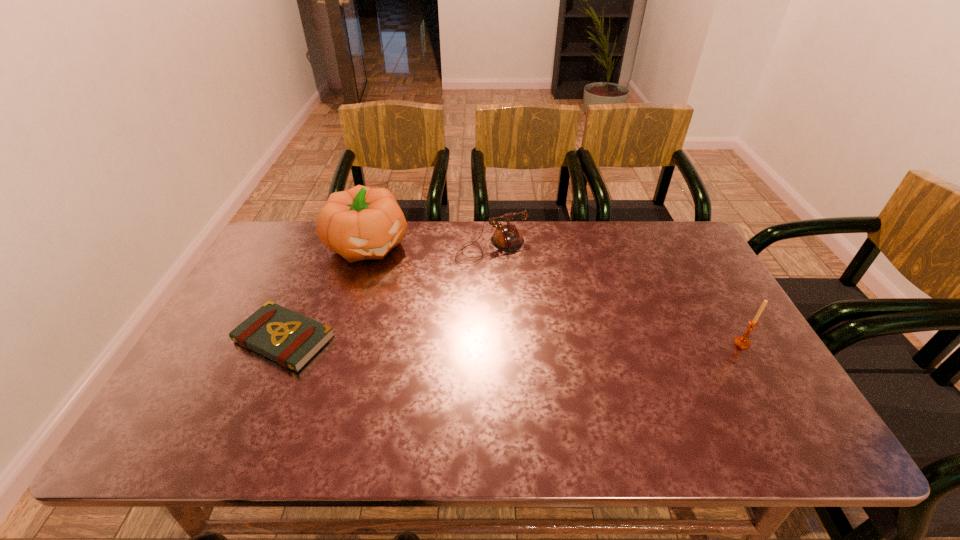
Find the location of a particular element. This screenshot has width=960, height=540. book is located at coordinates (291, 339).

Find the location of a particular element. The width and height of the screenshot is (960, 540). candle_holder is located at coordinates (742, 341).

Image resolution: width=960 pixels, height=540 pixels. I want to click on the second tallest object, so click(x=742, y=341).

Locate an element on the screen. This screenshot has width=960, height=540. telephone is located at coordinates (507, 237).

Find the location of a particular element. the third object from left to right is located at coordinates (507, 237).

This screenshot has height=540, width=960. What are the coordinates of `the tallest object` in the screenshot? It's located at (361, 223).

Image resolution: width=960 pixels, height=540 pixels. Identify the location of free space located on the right of the shortest object. (369, 339).

I want to click on free space located 0.080m on the left of the candle_holder, so click(x=704, y=343).

Locate an element on the screen. free space located 0.240m on the rotary dial of the third tallest object is located at coordinates (541, 316).

The image size is (960, 540). Identify the location of blank area located 0.370m on the rotary dial of the third tallest object. (564, 350).